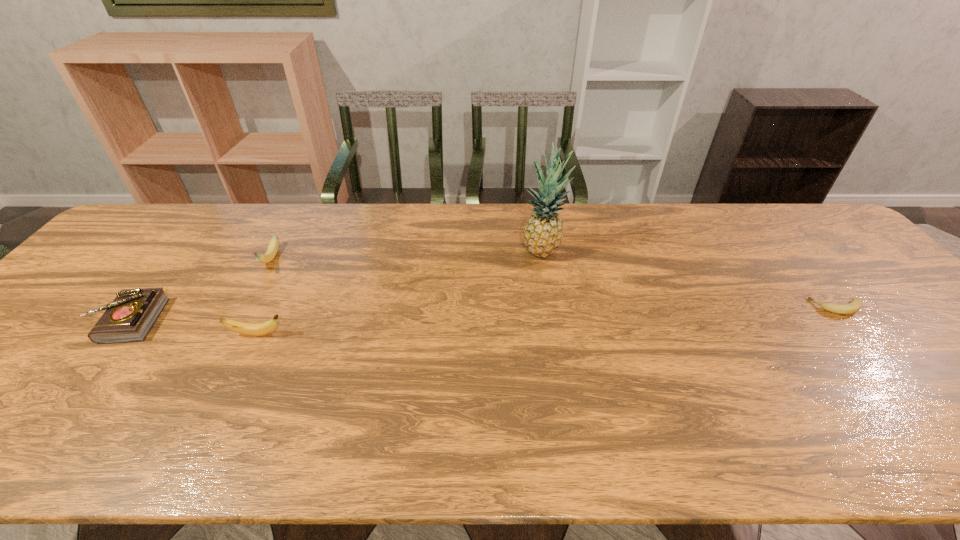
Find the location of a particular element. vacant space at the near edge of the desktop is located at coordinates (71, 461).

This screenshot has height=540, width=960. Find the location of `vacant region at the right edge of the desktop`. vacant region at the right edge of the desktop is located at coordinates (852, 282).

Find the location of a particular element. The image size is (960, 540). free space at the far left corner is located at coordinates (137, 245).

Where is `vacant area at the far right corner`? The image size is (960, 540). vacant area at the far right corner is located at coordinates (810, 213).

Find the location of a particular element. free space between the diary and the second nearest banana is located at coordinates (483, 314).

Where is `free space between the nearest banana and the second object from right to left`? Image resolution: width=960 pixels, height=540 pixels. free space between the nearest banana and the second object from right to left is located at coordinates (400, 293).

You are a GUI agent. You are given a task and a screenshot of the screen. Output one action in this format:
    pyautogui.click(x=<x>, y=<y>)
    Task: Click on the vacant point located between the farthest banana and the leftmost object
    This screenshot has height=540, width=960.
    Given the screenshot: What is the action you would take?
    pyautogui.click(x=200, y=290)

I want to click on vacant region between the pineapple and the second nearest banana, so click(x=689, y=279).

Locate an element on the screen. free space between the farthest banana and the leftmost object is located at coordinates (200, 290).

What are the coordinates of `vacant space that is in between the leftmost object and the farthest banana` in the screenshot? It's located at (200, 290).